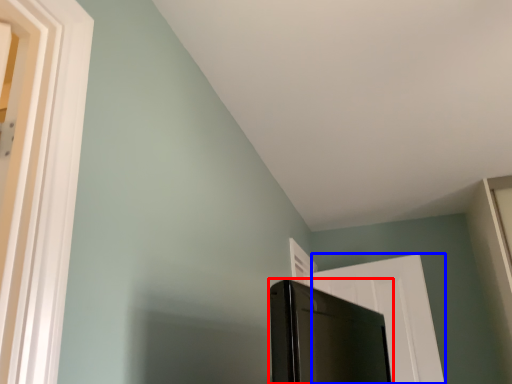
Question: Which object appears farthest to the camera in this image, screen door (highlighted by a red box) or door (highlighted by a blue box)?

Choices:
 (A) screen door
 (B) door

Answer: (B)